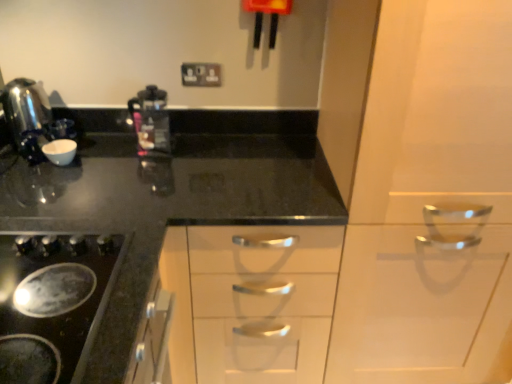
Describe the element at coordinates (151, 120) in the screenshot. Image resolution: width=512 pixels, height=384 pixels. I see `transparent plastic coffee machine at center` at that location.

Identify the location of polished stainless steel kettle at left. (27, 116).

The image size is (512, 384). Describe the element at coordinates (201, 74) in the screenshot. I see `black plastic electric outlet at upper center` at that location.

Image resolution: width=512 pixels, height=384 pixels. Identify the location of white glossy cabinet at center. (430, 202).

Measure the distance between white glossy cabinet at center and polished stainless steel kettle at left.

white glossy cabinet at center is 4.01 feet from polished stainless steel kettle at left.

What's the angular difference between white glossy cabinet at center and polished stainless steel kettle at left's facing directions?

The angular difference between white glossy cabinet at center and polished stainless steel kettle at left is 89.6 degrees.

Could you tell me if white glossy cabinet at center is facing polished stainless steel kettle at left?

No, white glossy cabinet at center is not aimed at polished stainless steel kettle at left.

Does white glossy cabinet at center have a lesser width compared to polished stainless steel kettle at left?

In fact, white glossy cabinet at center might be wider than polished stainless steel kettle at left.

Does black plastic electric outlet at upper center have a lesser height compared to black glass gas stove at lower left?

Incorrect, the height of black plastic electric outlet at upper center does not fall short of that of black glass gas stove at lower left.

How distant is black plastic electric outlet at upper center from black glass gas stove at lower left?

A distance of 36.33 inches exists between black plastic electric outlet at upper center and black glass gas stove at lower left.

Do you think black plastic electric outlet at upper center is within black glass gas stove at lower left, or outside of it?

black plastic electric outlet at upper center is not inside black glass gas stove at lower left, it's outside.

Considering the positions of objects black plastic electric outlet at upper center and black glass gas stove at lower left in the image provided, who is in front, black plastic electric outlet at upper center or black glass gas stove at lower left?

black glass gas stove at lower left is closer to the camera.

The height and width of the screenshot is (384, 512). Identify the location of coffee machine above the black glass gas stove at lower left (from a real-world perspective). (151, 120).

In the scene shown: Is transparent plastic coffee machine at center facing towards black glass gas stove at lower left?

No, transparent plastic coffee machine at center does not turn towards black glass gas stove at lower left.

Which of these two, transparent plastic coffee machine at center or black glass gas stove at lower left, stands shorter?

With less height is black glass gas stove at lower left.

Are transparent plastic coffee machine at center and black glass gas stove at lower left located far from each other?

transparent plastic coffee machine at center is actually quite close to black glass gas stove at lower left.

Between black glass gas stove at lower left and black plastic electric outlet at upper center, which one has more height?

black plastic electric outlet at upper center is taller.

Which object is thinner, black glass gas stove at lower left or black plastic electric outlet at upper center?

black plastic electric outlet at upper center.

How different are the orientations of black glass gas stove at lower left and black plastic electric outlet at upper center in degrees?

89.1 degrees.

Could you tell me if black glass gas stove at lower left is turned towards black plastic electric outlet at upper center?

No.

From a real-world perspective, is polished stainless steel kettle at left on top of black plastic electric outlet at upper center?

No, from a real-world perspective, polished stainless steel kettle at left is not over black plastic electric outlet at upper center

Image resolution: width=512 pixels, height=384 pixels. I want to click on kitchen appliance in front of the black plastic electric outlet at upper center, so click(x=27, y=116).

Measure the distance between polished stainless steel kettle at left and black plastic electric outlet at upper center.

The distance of polished stainless steel kettle at left from black plastic electric outlet at upper center is 21.95 inches.

From their relative heights in the image, would you say polished stainless steel kettle at left is taller or shorter than black plastic electric outlet at upper center?

Clearly, polished stainless steel kettle at left is taller compared to black plastic electric outlet at upper center.

Is white glossy cabinet at center turned away from transparent plastic coffee machine at center?

No, transparent plastic coffee machine at center is not at the back of white glossy cabinet at center.

Is white glossy cabinet at center surrounding transparent plastic coffee machine at center?

That's incorrect, transparent plastic coffee machine at center is not inside white glossy cabinet at center.

In terms of width, does white glossy cabinet at center look wider or thinner when compared to transparent plastic coffee machine at center?

white glossy cabinet at center is wider than transparent plastic coffee machine at center.

From a real-world perspective, which is physically above, white glossy cabinet at center or transparent plastic coffee machine at center?

From a 3D spatial view, transparent plastic coffee machine at center is above.

Which object is closer to the camera taking this photo, black plastic electric outlet at upper center or polished stainless steel kettle at left?

polished stainless steel kettle at left is in front.

Is there a large distance between black plastic electric outlet at upper center and polished stainless steel kettle at left?

black plastic electric outlet at upper center is near polished stainless steel kettle at left, not far away.

Between black plastic electric outlet at upper center and polished stainless steel kettle at left, which one has more height?

polished stainless steel kettle at left.

Identify the location of cabinetry on the right of polished stainless steel kettle at left. (430, 202).

You are a GUI agent. You are given a task and a screenshot of the screen. Output one action in this format:
    pyautogui.click(x=<x>, y=<y>)
    Task: Click on the gas stove lying below the black plastic electric outlet at upper center (from the image's perspective)
    The height and width of the screenshot is (384, 512).
    Given the screenshot: What is the action you would take?
    pyautogui.click(x=52, y=302)

Based on their spatial positions, is black plastic electric outlet at upper center or black glass gas stove at lower left further from transparent plastic coffee machine at center?

black glass gas stove at lower left is further to transparent plastic coffee machine at center.

Which object lies nearer to the anchor point white glossy cabinet at center, black plastic electric outlet at upper center or polished stainless steel kettle at left?

The object closer to white glossy cabinet at center is black plastic electric outlet at upper center.

Which object lies nearer to the anchor point transparent plastic coffee machine at center, white glossy cabinet at center or polished stainless steel kettle at left?

polished stainless steel kettle at left is closer to transparent plastic coffee machine at center.

When comparing their distances from white glossy cabinet at center, does polished stainless steel kettle at left or black glass gas stove at lower left seem closer?

Among the two, black glass gas stove at lower left is located nearer to white glossy cabinet at center.

Looking at the image, which one is located further to black plastic electric outlet at upper center, black glass gas stove at lower left or polished stainless steel kettle at left?

black glass gas stove at lower left is further to black plastic electric outlet at upper center.

Based on their spatial positions, is polished stainless steel kettle at left or black plastic electric outlet at upper center closer to white glossy cabinet at center?

black plastic electric outlet at upper center.

Estimate the real-world distances between objects in this image. Which object is closer to transparent plastic coffee machine at center, white glossy cabinet at center or black plastic electric outlet at upper center?

Among the two, black plastic electric outlet at upper center is located nearer to transparent plastic coffee machine at center.

From the image, which object appears to be farther from black glass gas stove at lower left, black plastic electric outlet at upper center or transparent plastic coffee machine at center?

black plastic electric outlet at upper center is further to black glass gas stove at lower left.

This screenshot has width=512, height=384. Find the location of `kitchen appliance between black glass gas stove at lower left and transparent plastic coffee machine at center from front to back`. kitchen appliance between black glass gas stove at lower left and transparent plastic coffee machine at center from front to back is located at coordinates (27, 116).

Image resolution: width=512 pixels, height=384 pixels. Find the location of `coffee machine between black glass gas stove at lower left and white glossy cabinet at center in the horizontal direction`. coffee machine between black glass gas stove at lower left and white glossy cabinet at center in the horizontal direction is located at coordinates coord(151,120).

Identify the location of coffee machine between polished stainless steel kettle at left and black plastic electric outlet at upper center. (151, 120).

You are a GUI agent. You are given a task and a screenshot of the screen. Output one action in this format:
    pyautogui.click(x=<x>, y=<y>)
    Task: Click on the electric outlet between transparent plastic coffee machine at center and white glossy cabinet at center
    
    Given the screenshot: What is the action you would take?
    pyautogui.click(x=201, y=74)